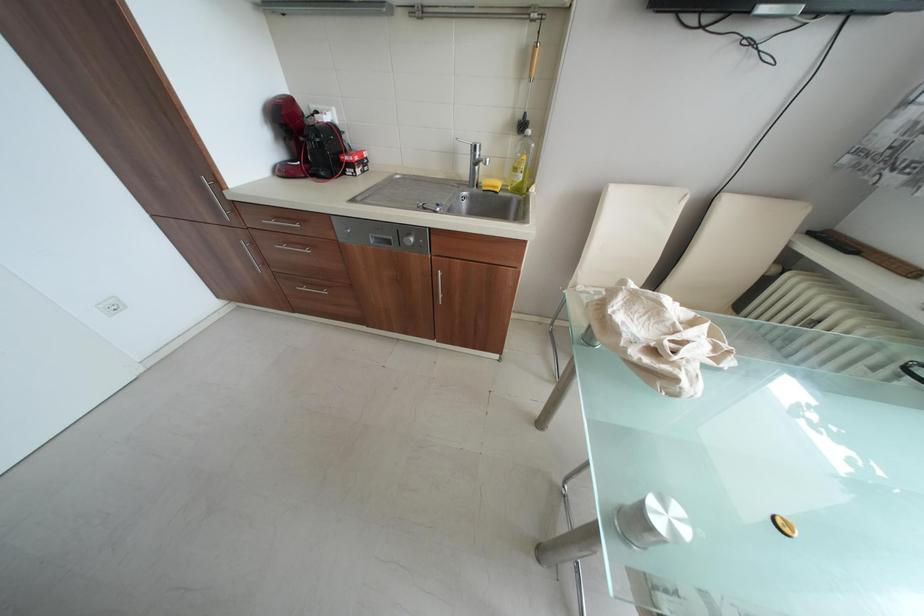
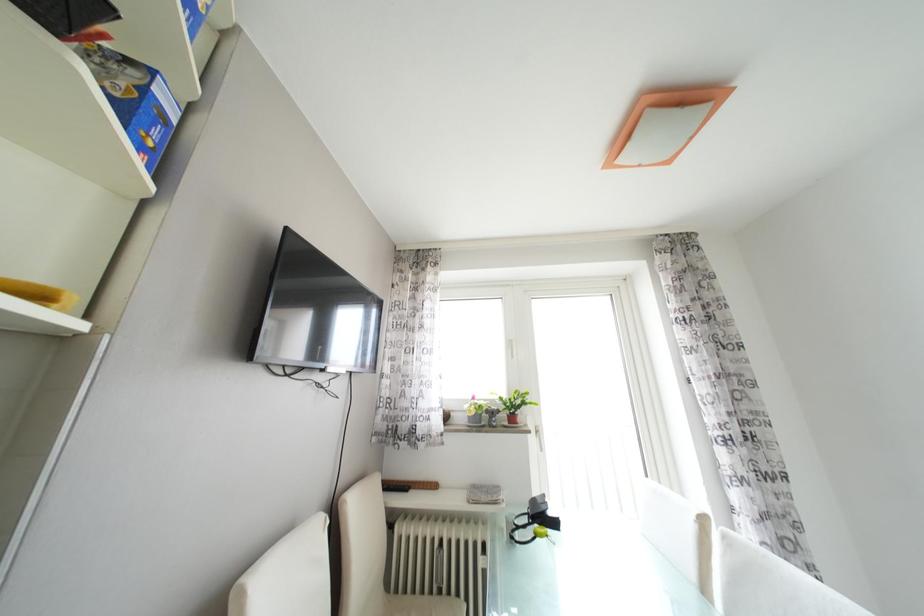
Question: Based on the continuous images, in which direction is the camera rotating? Reply with the corresponding letter.

Choices:
 (A) Left
 (B) Right
 (C) Up
 (D) Down

Answer: (B)